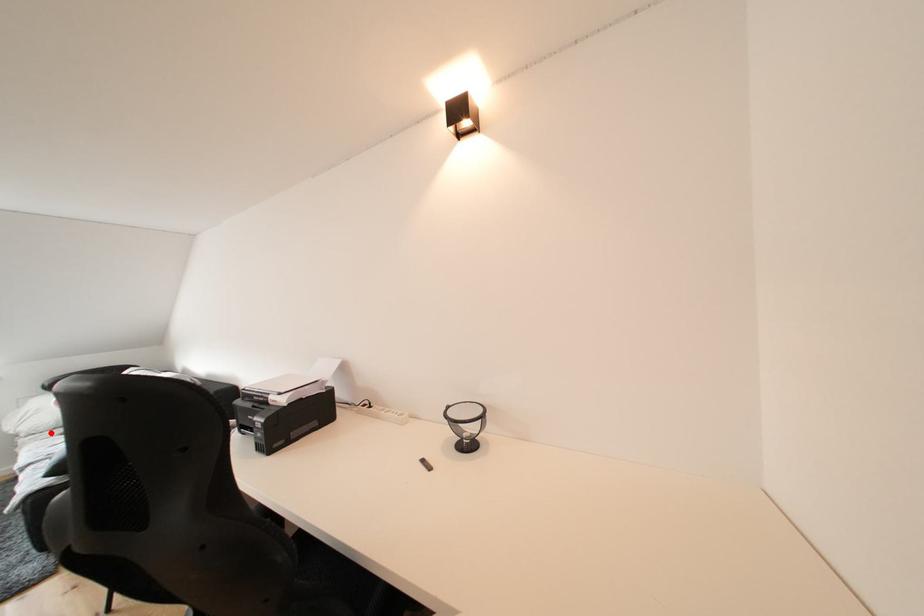
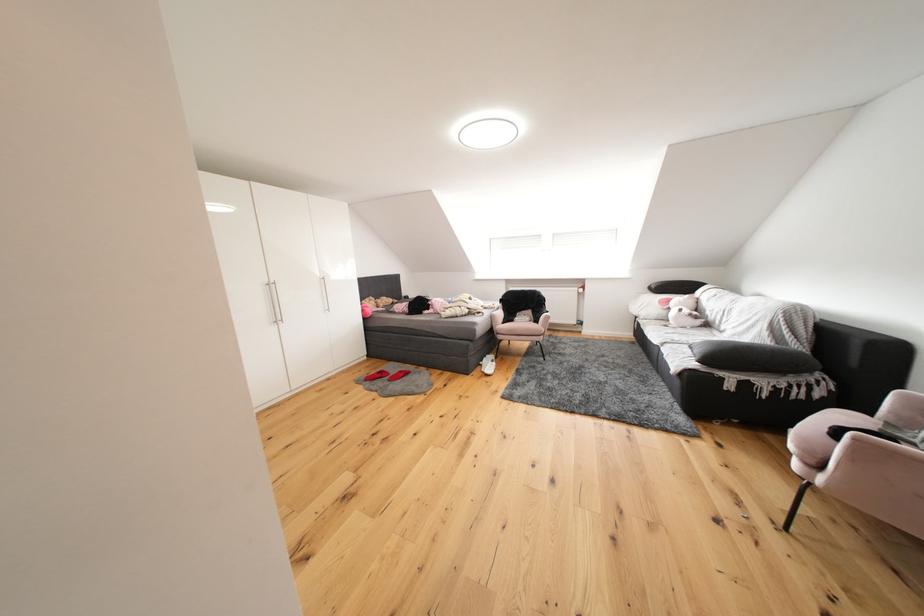
Where in the second image is the point corresponding to the highlighted location from the first image?

(660, 321)